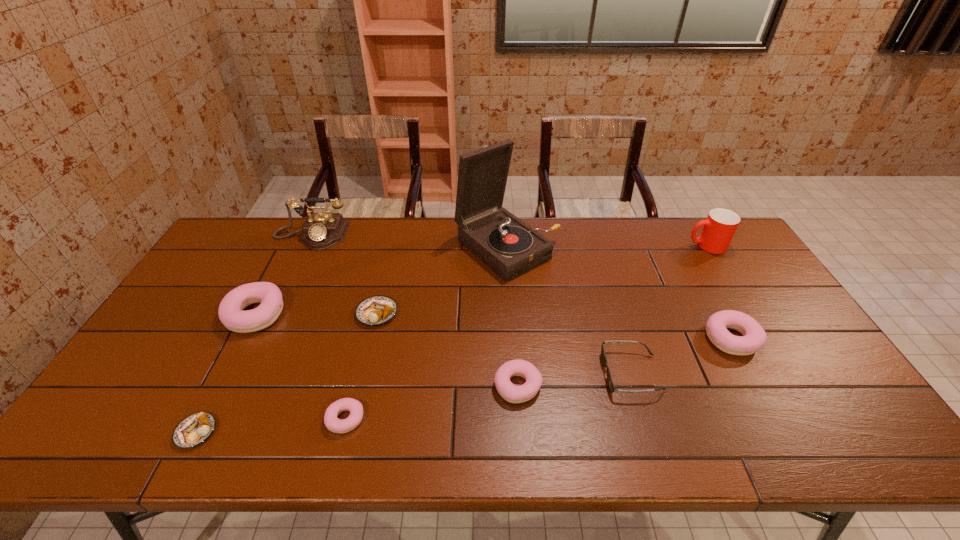
Image resolution: width=960 pixels, height=540 pixels. I want to click on free space located on the right of the third pink pastry from right to left, so click(x=504, y=419).

Find the location of `free space located on the back of the left brown pastry`. free space located on the back of the left brown pastry is located at coordinates (259, 308).

Locate an element on the screen. The width and height of the screenshot is (960, 540). phonograph record that is at the far edge is located at coordinates (506, 244).

Find the location of a particular element. The width and height of the screenshot is (960, 540). telephone located in the far edge section of the desktop is located at coordinates (322, 230).

Where is `cup positioned at the far edge`? This screenshot has height=540, width=960. cup positioned at the far edge is located at coordinates (719, 228).

Locate an element on the screen. Image resolution: width=960 pixels, height=540 pixels. object present at the left edge is located at coordinates (230, 312).

Where is `cup positioned at the right edge`? Image resolution: width=960 pixels, height=540 pixels. cup positioned at the right edge is located at coordinates (719, 228).

Image resolution: width=960 pixels, height=540 pixels. What are the coordinates of `pastry situated at the right edge` in the screenshot? It's located at (754, 337).

Where is `object that is at the far right corner`? This screenshot has height=540, width=960. object that is at the far right corner is located at coordinates (719, 228).

In the image, there is a desktop. Find the location of `vacant space at the far edge`. vacant space at the far edge is located at coordinates (618, 221).